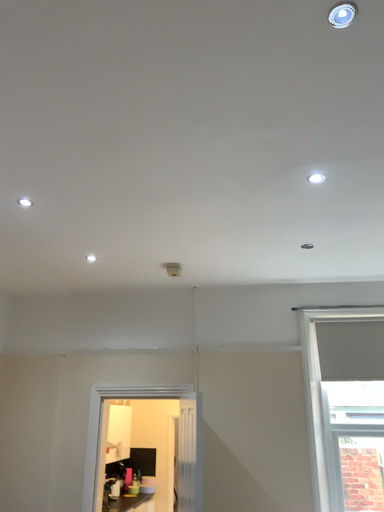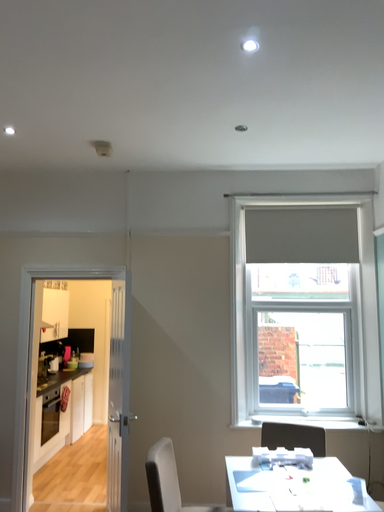
Question: How did the camera likely rotate when shooting the video?

Choices:
 (A) rotated downward
 (B) rotated upward

Answer: (A)